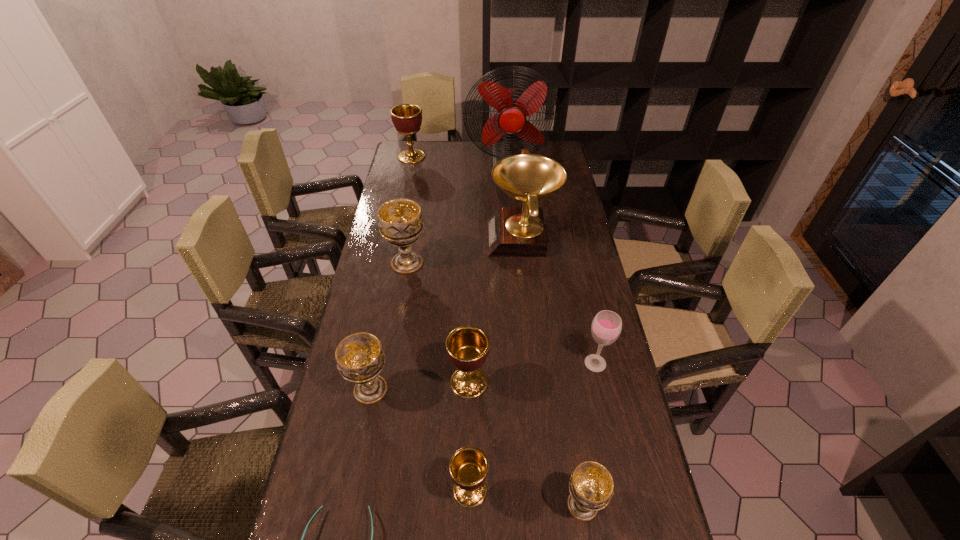
Where is `object that is at the far right corner`? object that is at the far right corner is located at coordinates (513, 106).

In the image, there is a desktop. Identify the location of vacant space at the far edge. This screenshot has height=540, width=960. (443, 148).

Locate an element on the screen. The height and width of the screenshot is (540, 960). vacant point at the left edge is located at coordinates (380, 251).

Image resolution: width=960 pixels, height=540 pixels. What are the coordinates of `vacant region at the right edge` in the screenshot? It's located at (567, 401).

Where is `free space between the tallest object and the wineglass`? This screenshot has height=540, width=960. free space between the tallest object and the wineglass is located at coordinates (552, 263).

Where is `vacant area that lies between the second nearest golden chalice and the smallest white chalice`? The height and width of the screenshot is (540, 960). vacant area that lies between the second nearest golden chalice and the smallest white chalice is located at coordinates (526, 443).

Identify the location of vacant space that's between the nearest golden chalice and the fifth nearest chalice. (439, 376).

Locate an element on the screen. vacant area that lies between the leftmost golden chalice and the tallest object is located at coordinates (460, 160).

Image resolution: width=960 pixels, height=540 pixels. In order to click on empty location between the nearest white chalice and the tallest object in this screenshot , I will do `click(545, 334)`.

At what (x,y) coordinates should I click in order to perform the action: click on vacant point located between the fifth nearest chalice and the second smallest golden chalice. Please return your answer as a coordinate pair (x, y). The image size is (960, 540). Looking at the image, I should click on (438, 322).